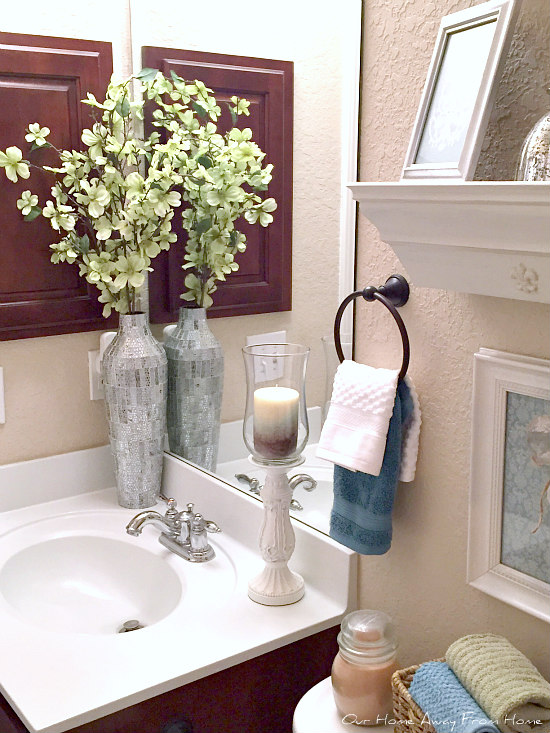
Identify the location of shelf. This screenshot has height=733, width=550. (477, 209).